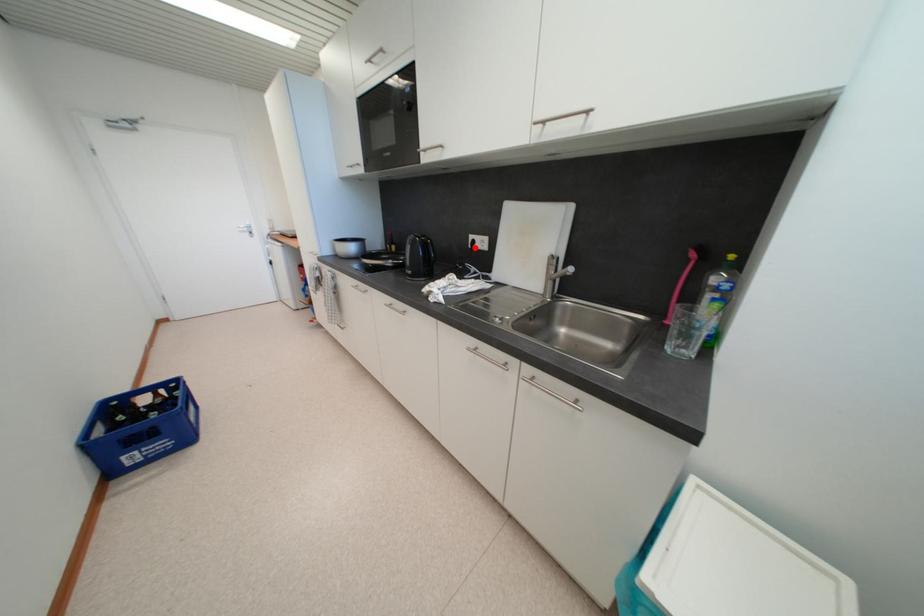
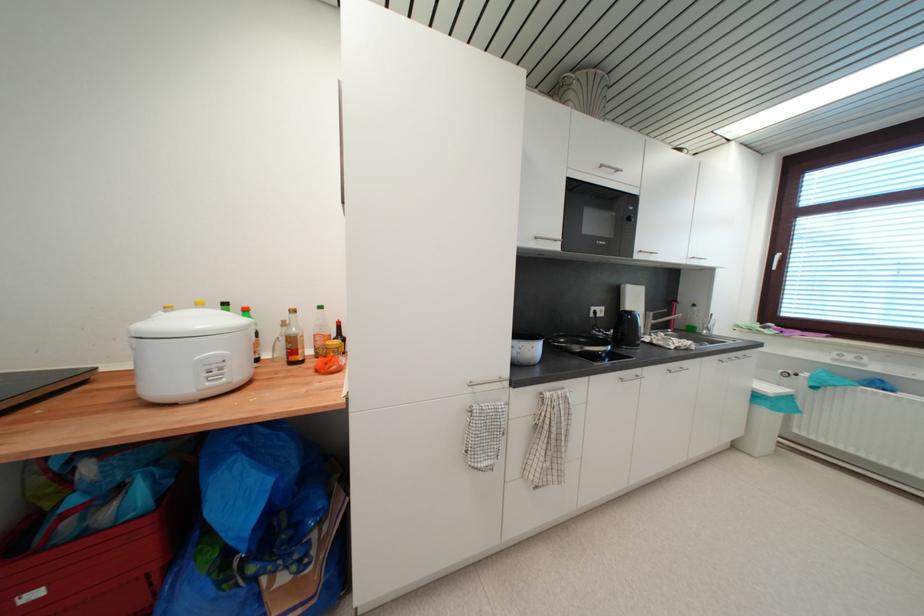
Locate, in the second image, the point that corresponds to the highlighted location in the first image.

(597, 317)